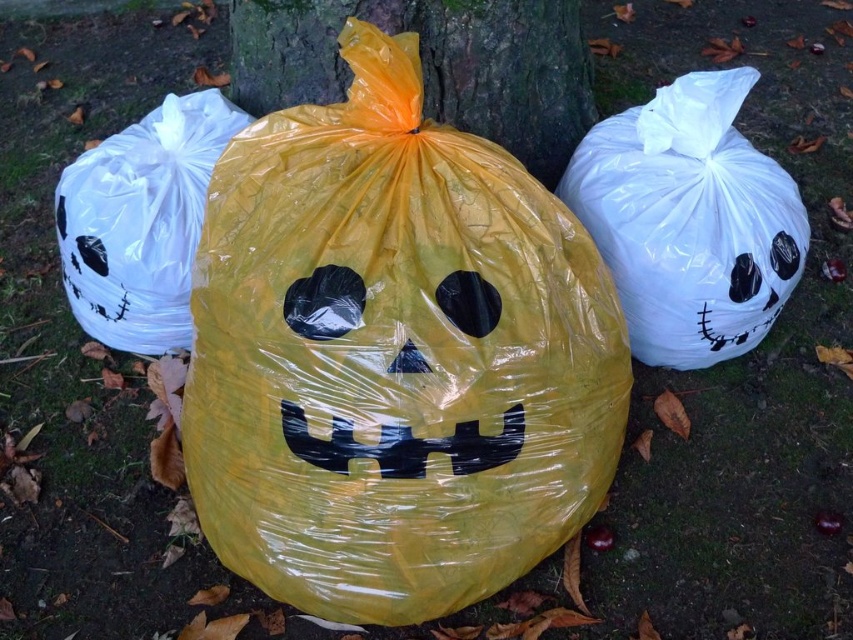
Question: Which object appears farthest from the camera in this image?

Choices:
 (A) smooth bark tree trunk at center
 (B) white plastic bag at left
 (C) white glossy trash bag at right
 (D) yellow plastic bag at center

Answer: (A)

Question: Is yellow plastic bag at center below white plastic bag at left?

Choices:
 (A) no
 (B) yes

Answer: (B)

Question: Among these objects, which one is nearest to the camera?

Choices:
 (A) white glossy trash bag at right
 (B) smooth bark tree trunk at center
 (C) white plastic bag at left

Answer: (A)

Question: Is white glossy trash bag at right to the right of smooth bark tree trunk at center from the viewer's perspective?

Choices:
 (A) no
 (B) yes

Answer: (B)

Question: Which point appears closest to the camera in this image?

Choices:
 (A) (393, 198)
 (B) (335, 26)

Answer: (A)

Question: Can you confirm if white glossy trash bag at right is wider than smooth bark tree trunk at center?

Choices:
 (A) yes
 (B) no

Answer: (B)